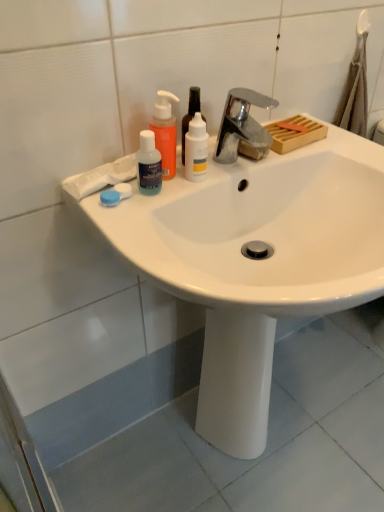
Where is `vacant area that is in front of translucent orange pump bottle at upper left`? vacant area that is in front of translucent orange pump bottle at upper left is located at coordinates (147, 218).